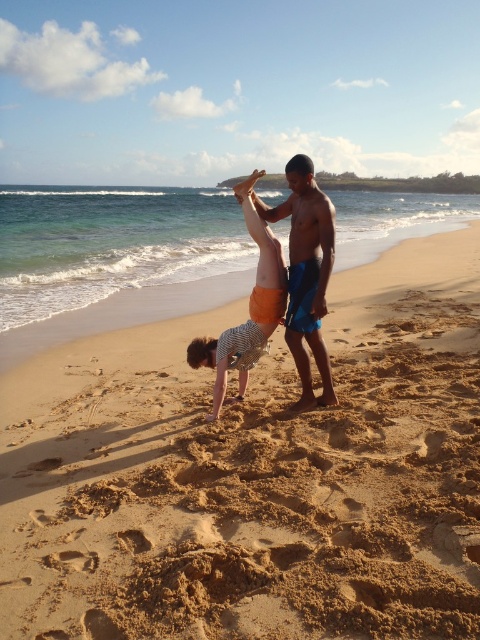
You are standing at the edge of the ocean looking towards the shore. There is a sandy yellow sand at center marked by the point (254, 474). If you walk straight towards the shore from your current position, will you reach the sandy yellow sand at center before reaching the water?

Yes, because the sandy yellow sand at center is located at point (254, 474), which is on the shore, so walking straight towards the shore would lead you to it before reaching the water.

You are a photographer trying to capture a photo of the striped cotton shirt at center and the sandy yellow sand at center. Which object will appear taller in the photo?

The striped cotton shirt at center will appear taller in the photo since it is taller than the sandy yellow sand at center.

You are standing on the beach and see two points marked in the sand. Which point is closer to you, point (399, 282) or point (322, 365)?

Point (399, 282) is further to the viewer than point (322, 365), so point (322, 365) is closer to you.